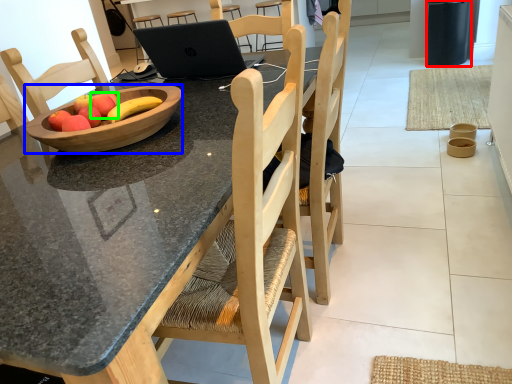
Question: Which object is positioned farthest from trash bin/can (highlighted by a red box)? Select from bowl (highlighted by a blue box) and apple (highlighted by a green box).

Choices:
 (A) bowl
 (B) apple

Answer: (B)